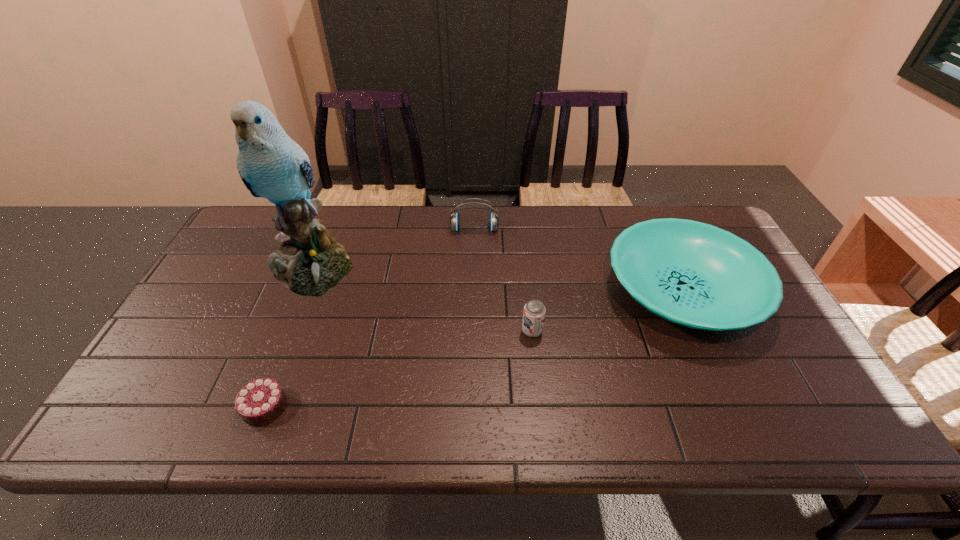
What are the coordinates of `free space located on the front of the beer can` in the screenshot? It's located at (536, 366).

What are the coordinates of `blank space located 0.240m on the left of the chocolate cake` in the screenshot? It's located at (136, 407).

Locate an element on the screen. This screenshot has width=960, height=540. parakeet situated at the far edge is located at coordinates (310, 262).

I want to click on headset present at the far edge, so click(x=454, y=220).

Where is `dish located in the far edge section of the desktop`? Image resolution: width=960 pixels, height=540 pixels. dish located in the far edge section of the desktop is located at coordinates (693, 274).

Locate an element on the screen. The width and height of the screenshot is (960, 540). object situated at the near edge is located at coordinates (261, 401).

Find the location of `object that is at the right edge`. object that is at the right edge is located at coordinates (693, 274).

Where is `object that is at the far right corner`? object that is at the far right corner is located at coordinates (693, 274).

You are a GUI agent. You are given a task and a screenshot of the screen. Output one action in this format:
    pyautogui.click(x=<x>, y=<y>)
    Task: Click on the free spot at the far edge of the desktop
    
    Given the screenshot: What is the action you would take?
    pyautogui.click(x=340, y=233)

Identify the location of vacant space at the near edge of the desktop. This screenshot has height=540, width=960. (184, 436).